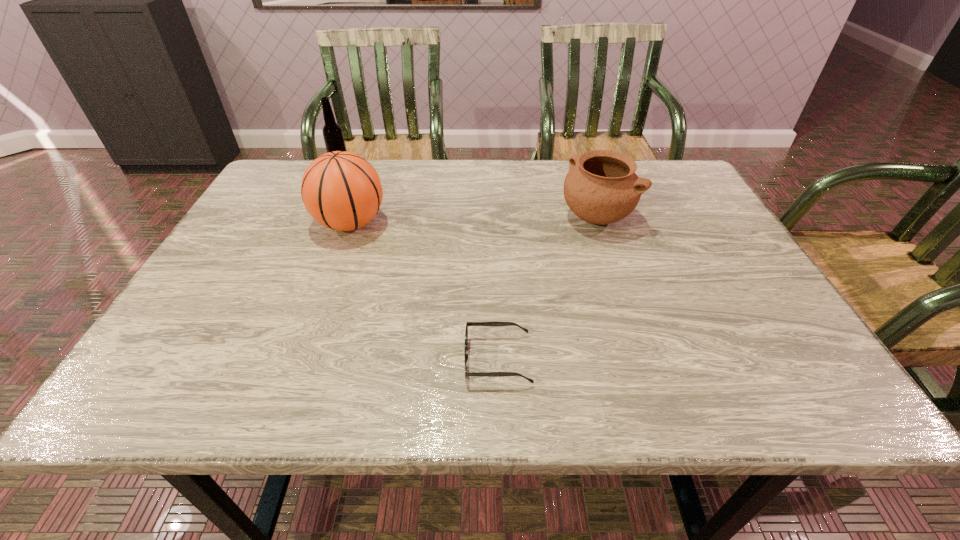
The width and height of the screenshot is (960, 540). Identify the location of vacant space at the left edge of the desktop. (252, 269).

In the image, there is a desktop. Where is `vacant space at the right edge`? Image resolution: width=960 pixels, height=540 pixels. vacant space at the right edge is located at coordinates (678, 206).

Identify the location of vacant space at the near left corner of the desktop. The height and width of the screenshot is (540, 960). coord(196,372).

This screenshot has width=960, height=540. Identify the location of vacant space that is in between the nearest object and the farthest object. (420, 263).

I want to click on unoccupied position between the farthest object and the rightmost object, so click(x=468, y=192).

This screenshot has height=540, width=960. I want to click on free spot between the beer bottle and the nearest object, so pos(420,263).

Locate an element on the screen. The height and width of the screenshot is (540, 960). free space between the second shortest object and the sunglasses is located at coordinates [547, 288].

The width and height of the screenshot is (960, 540). In order to click on vacant area between the rightmost object and the farthest object in this screenshot , I will do `click(468, 192)`.

What are the coordinates of `vacant point located between the shortest object and the basketball` in the screenshot? It's located at (424, 291).

This screenshot has width=960, height=540. What are the coordinates of `vacant area that lies between the nearest object and the beer bottle` in the screenshot? It's located at (420, 263).